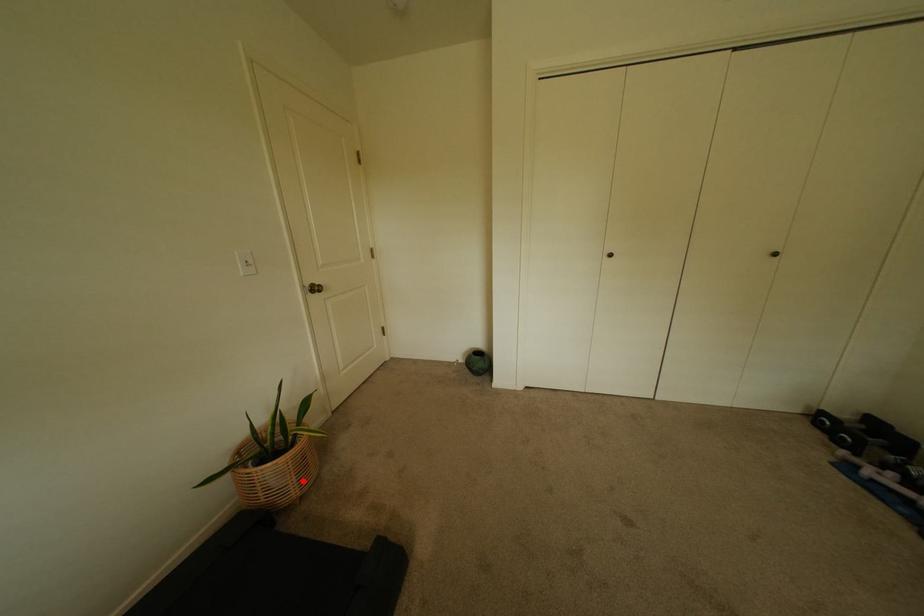
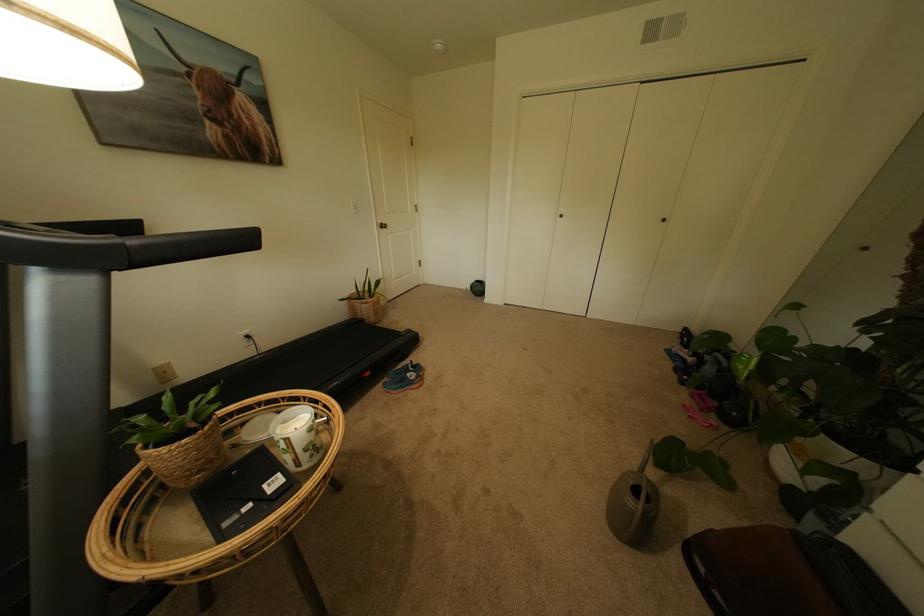
In the second image, find the point that corresponds to the highlighted location in the first image.

(382, 314)